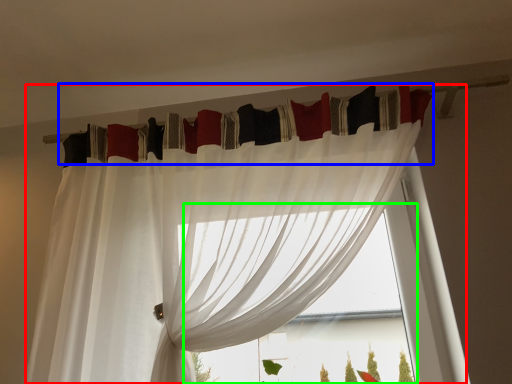
Question: Based on their relative distances, which object is farther from curtain (highlighted by a red box)? Choose from curtain (highlighted by a blue box) and bay window (highlighted by a green box).

Choices:
 (A) curtain
 (B) bay window

Answer: (B)